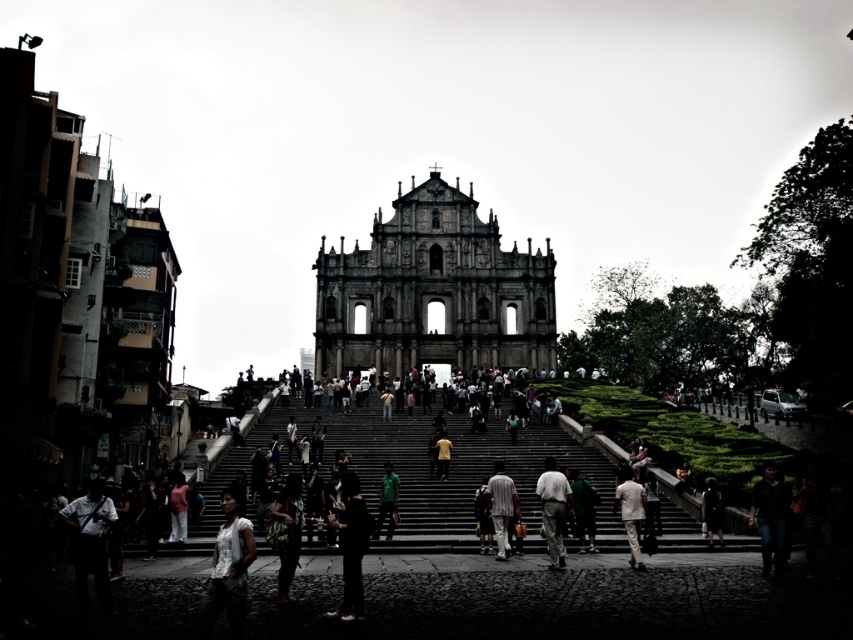
Question: Is brown textured building at left closer to camera compared to dark brown leather jacket at lower right?

Choices:
 (A) yes
 (B) no

Answer: (A)

Question: Among these points, which one is nearest to the camera?

Choices:
 (A) tap(627, 515)
 (B) tap(390, 468)

Answer: (A)

Question: Which object is farther from the camera taking this photo?

Choices:
 (A) brown textured building at left
 (B) dark stone stairs at center
 (C) dark brown leather jacket at lower right

Answer: (B)

Question: Is green textured dress at center in front of yellow fabric at center?

Choices:
 (A) no
 (B) yes

Answer: (B)

Question: From the image, what is the correct spatial relationship of dark stone stairs at center in relation to dark green fabric jacket at lower right?

Choices:
 (A) below
 (B) above

Answer: (B)

Question: Among these points, which one is nearest to the camera?

Choices:
 (A) (579, 540)
 (B) (428, 545)
 (C) (489, 394)

Answer: (B)